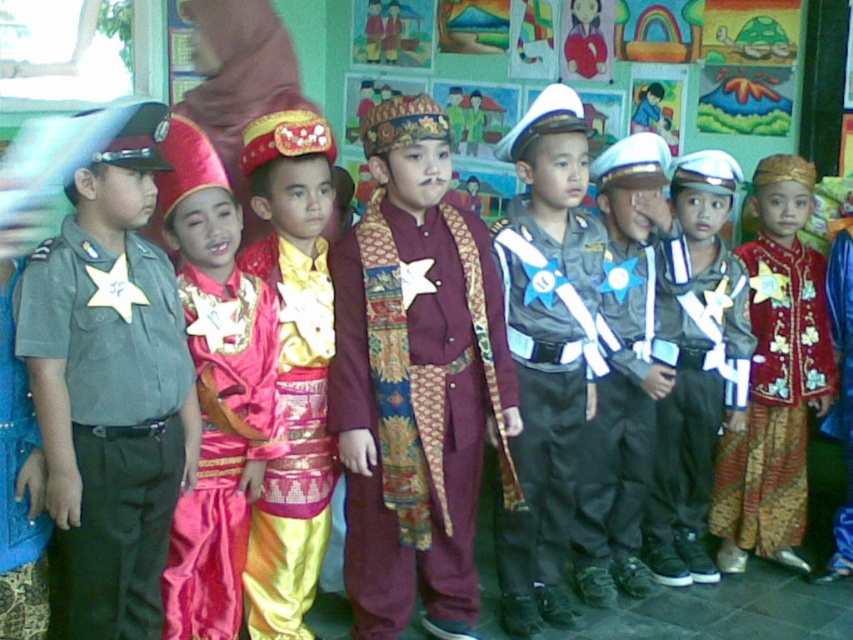
You are a photographer setting up a tripod to capture the group of children in the scene. You need to ensure that both the maroon satin robe at center and the matte black uniform at center are fully visible in the frame. Considering their heights, which child should you position closer to the front to avoid blocking the other?

The matte black uniform at center is shorter in height compared to the maroon satin robe at center. To ensure both are fully visible, position the shorter matte black uniform at center closer to the front so it isn t blocked by the taller maroon satin robe at center.

You are standing in front of the group of children dressed in costumes. You need to locate the maroon satin robe at center. Based on the coordinates provided, can you determine its position relative to the other children?

The maroon satin robe at center is positioned at coordinates approximately 0.597 on the x axis and 0.489 on the y axis. This places it centrally within the image, likely between the police officer on the far left and the royal or ceremonial child next to them, as it is neither too far left nor right.

From the picture: You are a photographer standing at the back of the room. You want to take a photo that includes both the point at (408, 554) and the point at (732, 424). Which point should you focus on first to ensure both are in the frame?

You should focus on point (408, 554) first because it is in front of point (732, 424), ensuring both are visible in the photo.